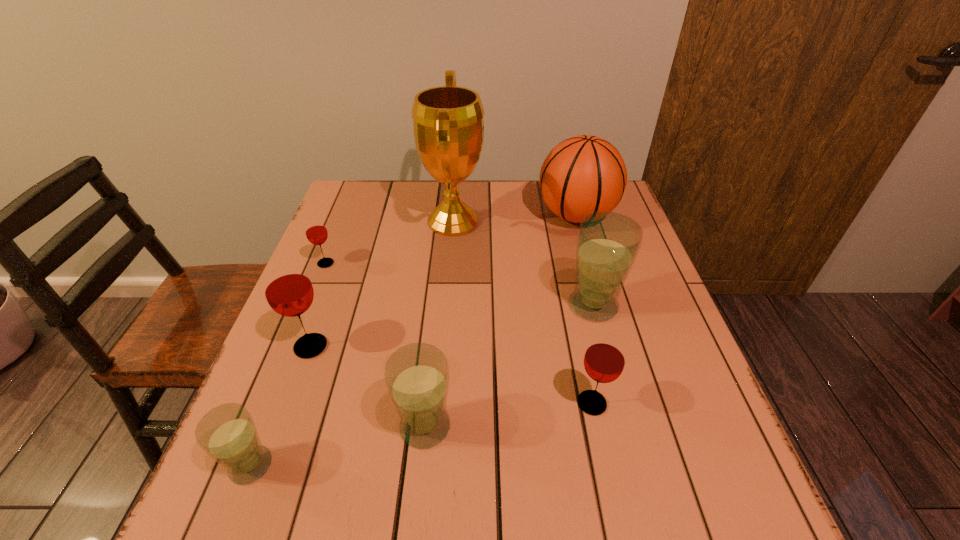
You are a GUI agent. You are given a task and a screenshot of the screen. Output one action in this format:
    pyautogui.click(x=<x>, y=<y>)
    Task: Click on the vacant area between the nearest red glass and the biggest red glass
    
    Given the screenshot: What is the action you would take?
    pyautogui.click(x=451, y=375)

Find the location of a particular element. The image size is (960, 540). object that can be found as the fourth closest to the fifth farthest object is located at coordinates (448, 124).

Identify the location of object that stands as the fifth closest to the smallest blue glass. The width and height of the screenshot is (960, 540). (604, 360).

Choose which glass is the nearest neighbor to the smallest red glass. Please provide its 2D coordinates. Your answer should be formatted as a tuple, i.e. [(x, y)], where the tuple contains the x and y coordinates of a point satisfying the conditions above.

[(288, 290)]

Select which glass appears as the fourth closest to the smallest blue glass. Please provide its 2D coordinates. Your answer should be formatted as a tuple, i.e. [(x, y)], where the tuple contains the x and y coordinates of a point satisfying the conditions above.

[(604, 360)]

The height and width of the screenshot is (540, 960). I want to click on blue glass that is the second closest to the basketball, so click(x=417, y=377).

Locate which blue glass ranks in proximity to the rightmost red glass. Please provide its 2D coordinates. Your answer should be formatted as a tuple, i.e. [(x, y)], where the tuple contains the x and y coordinates of a point satisfying the conditions above.

[(608, 243)]

Identify which red glass is located as the second nearest to the basketball. Please provide its 2D coordinates. Your answer should be formatted as a tuple, i.e. [(x, y)], where the tuple contains the x and y coordinates of a point satisfying the conditions above.

[(316, 232)]

The width and height of the screenshot is (960, 540). What are the coordinates of `red glass identified as the second closest to the farthest glass` in the screenshot? It's located at (604, 360).

Image resolution: width=960 pixels, height=540 pixels. Identify the location of vacant space that satisfies the following two spatial constraints: 1. on the front side of the fifth farthest object; 2. on the right side of the second smallest blue glass. (281, 427).